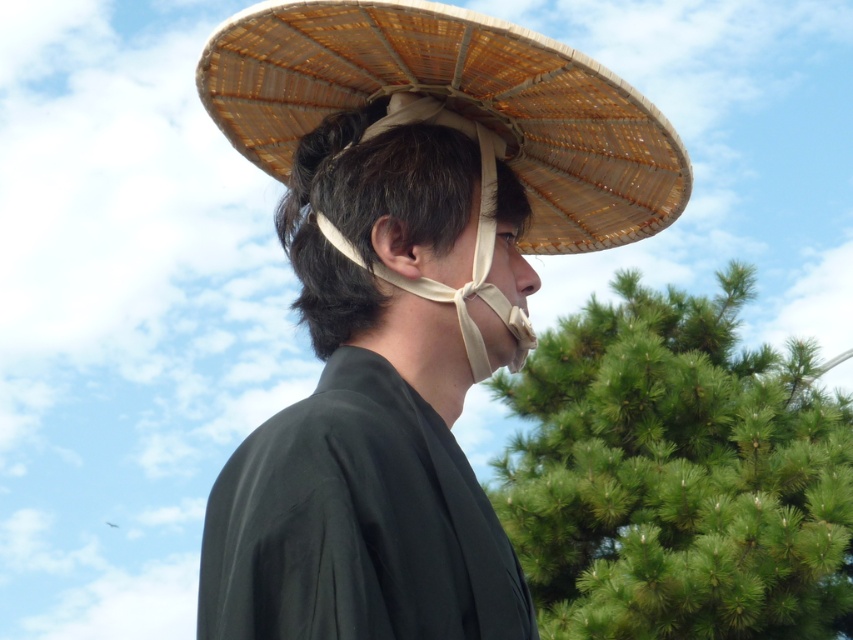
You are taking a photo of two points in the scene. The first point is at coordinates point (x=440, y=68) and the second is at point (x=300, y=200). Which point appears closer to you in the photo?

Point (x=440, y=68) is closer to the camera than point (x=300, y=200), so it appears closer in the photo.

You are standing in a park and see a person wearing a brown woven straw hat at upper center. If you walk directly towards the person, which direction should you look to see the hat?

Since the brown woven straw hat at upper center is located at point 0.166 on the x axis and 0.533 on the y axis, you should look towards the upper center direction to see the hat as you approach the person.